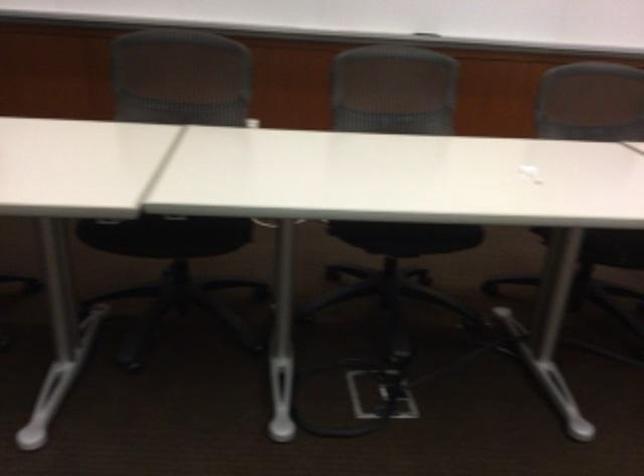
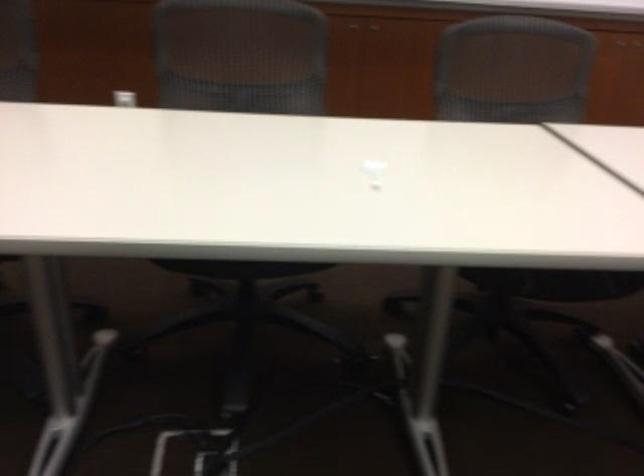
Question: I am providing you with two images of the same scene from different viewpoints. After the viewpoint changes to image2, which objects are now occluded?

Choices:
 (A) white soap dispenser
 (B) grey chair sitting surface
 (C) white chair lever
 (D) chair sitting surface

Answer: (D)